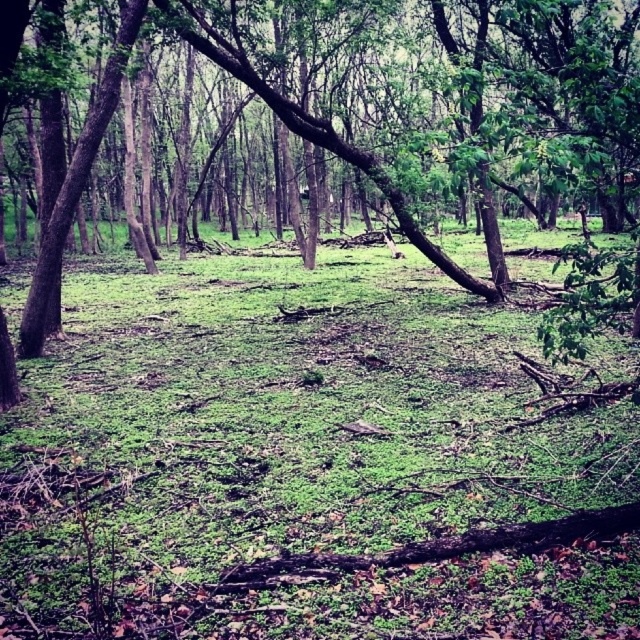
You are navigating through the forest and want to step onto the green mossy ground at center. Based on its position, where exactly would you find this mossy area?

The green mossy ground at center is located at point [300,460], which means it is positioned towards the lower right section of the scene.

You are a hiker who wants to take a photo of the green leafy tree at center without the green mossy ground at center blocking the view. How should you adjust your position?

The green leafy tree at center is behind the green mossy ground at center, so you should move your position to a higher elevation to look over the green mossy ground at center and capture the green leafy tree at center clearly.

You are a hiker trying to navigate through the forest. You see the green mossy ground at center and the green leafy tree at center. Which one do you think is closer to you?

The green mossy ground at center is closer to you because it is smaller than the green leafy tree at center, indicating it is in the foreground.